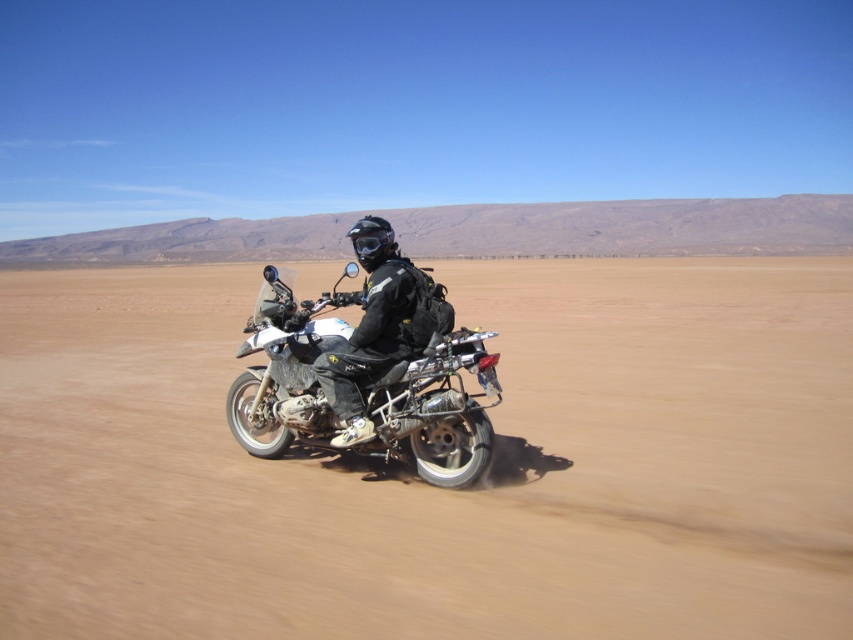
Question: Does black matte jacket at center appear over clear plastic goggles at center?

Choices:
 (A) yes
 (B) no

Answer: (B)

Question: Can you confirm if brown sandy terrain at center is bigger than black matte jacket at center?

Choices:
 (A) yes
 (B) no

Answer: (A)

Question: Is matte black motorcycle at center closer to camera compared to black matte jacket at center?

Choices:
 (A) no
 (B) yes

Answer: (B)

Question: Which is nearer to the brown sandy terrain at center?

Choices:
 (A) black matte jacket at center
 (B) black matte helmet at center
 (C) clear plastic goggles at center
 (D) matte black motorcycle at center

Answer: (A)

Question: Which object appears closest to the camera in this image?

Choices:
 (A) brown sandy terrain at center
 (B) clear plastic goggles at center

Answer: (A)

Question: Based on their relative distances, which object is nearer to the brown sandy terrain at center?

Choices:
 (A) black matte helmet at center
 (B) black matte jacket at center

Answer: (B)